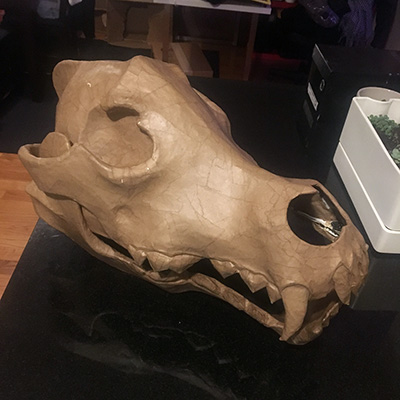
Locate an element on the screen. black countertop is located at coordinates (142, 332).